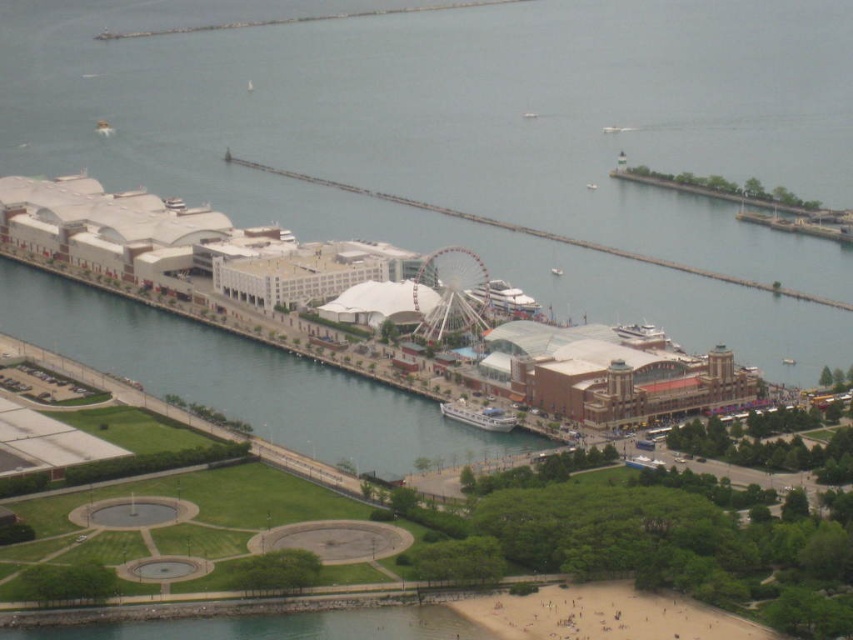
You are standing at the edge of the green grass at lower center and want to walk directly towards the white metallic ferris wheel at center. Is there any obstruction between you and the ferris wheel?

The green grass at lower center is positioned over the white metallic ferris wheel at center, meaning there is no obstruction between them. You can walk directly towards the ferris wheel without any obstacles.

From the picture: You are standing at the center of the Ferris wheel and want to find the green grass at lower center. Which direction should you look to see it?

The green grass at lower center is located at point (479, 140), so you should look towards the lower center direction to see it.

You are planning to set up a picnic area in the waterfront area shown. You have a picnic blanket that is 3 meters wide. The green grass at lower center and the white metallic ferris wheel at center are in your view. Can you place your picnic blanket on the grass without it overlapping the Ferris wheel?

The green grass at lower center might be wider than the white metallic ferris wheel at center. If the grass area is indeed wider than 3 meters, the blanket can be placed there without overlapping the Ferris wheel. However, since the exact width isn not specified, you should verify the space before setting up.